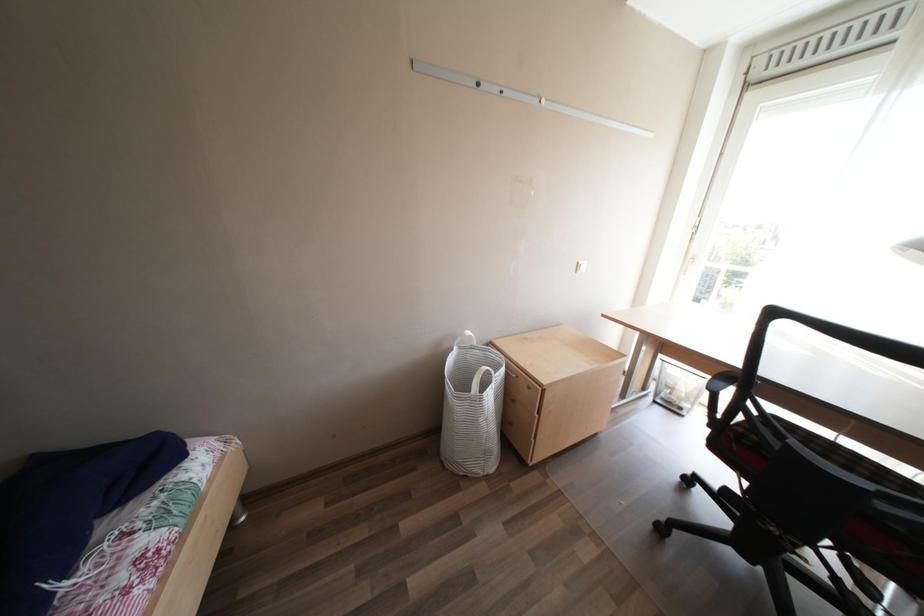
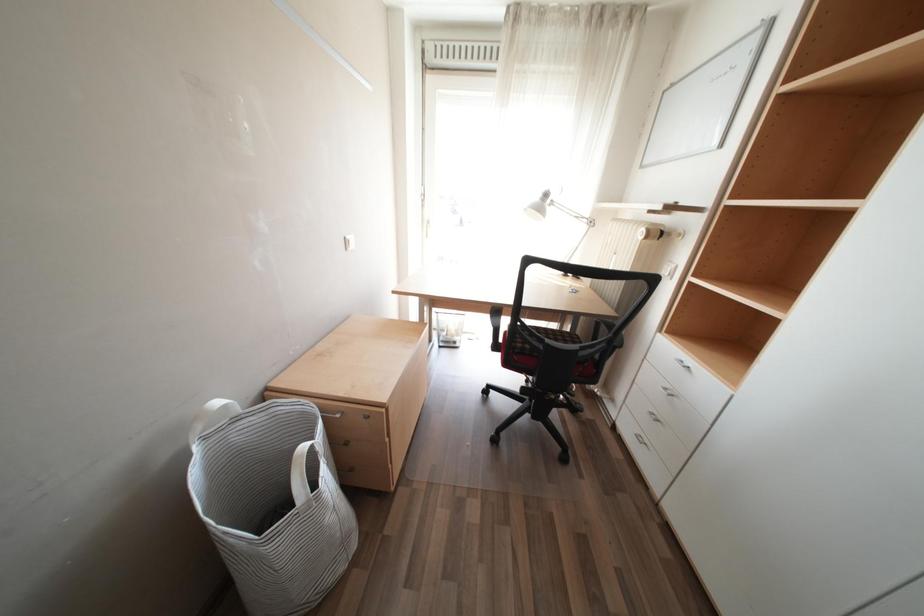
Question: The camera is either moving clockwise (left) or counter-clockwise (right) around the object. The first image is from the beginning of the video and the second image is from the end. Is the camera moving left or right when shooting the video?

Choices:
 (A) Left
 (B) Right

Answer: (A)